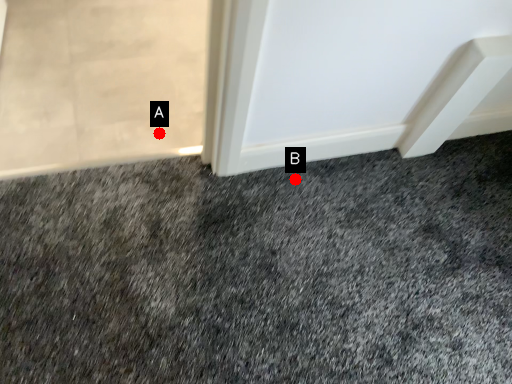
Question: Two points are circled on the image, labeled by A and B beside each circle. Among these points, which one is farthest from the camera?

Choices:
 (A) A is further
 (B) B is further

Answer: (A)